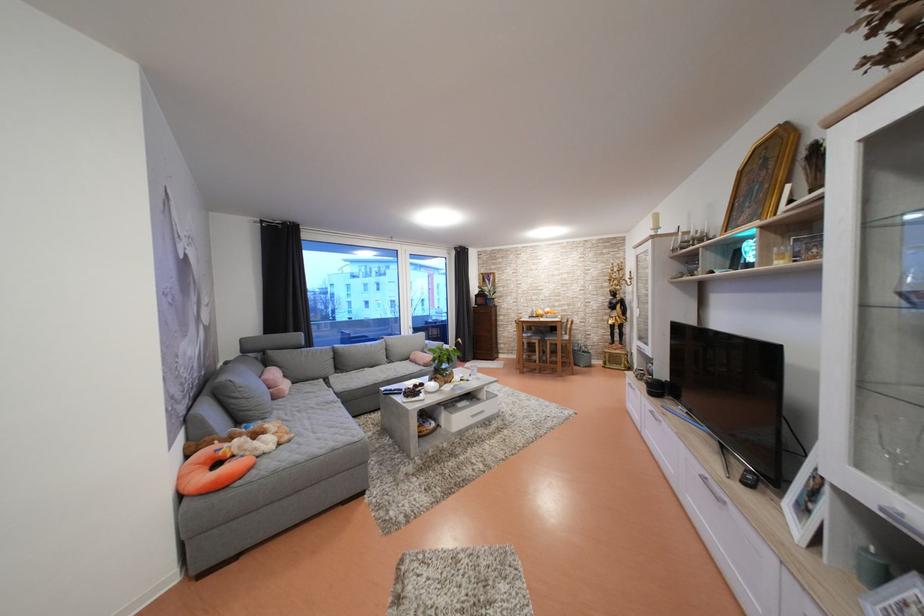
Which object does [444,363] point to?

This point indicates the glass flower vase.